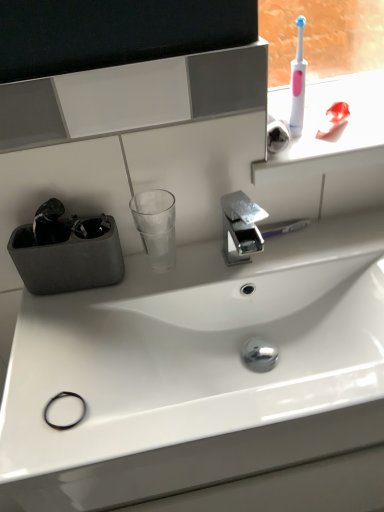
You are a GUI agent. You are given a task and a screenshot of the screen. Output one action in this format:
    pyautogui.click(x=<x>, y=<y>)
    Task: Click on the free space above white glossy sink at center (from a real-world perspective)
    
    Given the screenshot: What is the action you would take?
    pyautogui.click(x=201, y=281)